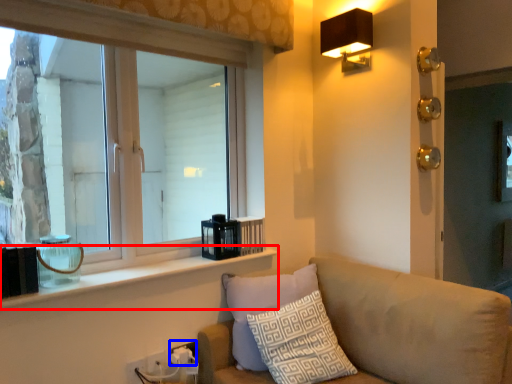
Question: Which object appears closest to the camera in this image, window sill (highlighted by a red box) or electric outlet (highlighted by a blue box)?

Choices:
 (A) window sill
 (B) electric outlet

Answer: (A)